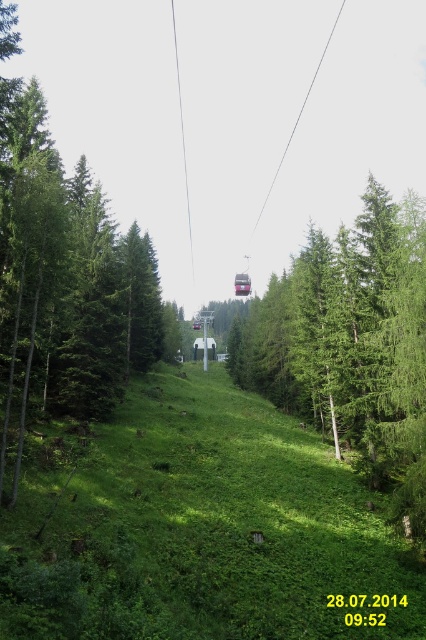
Which of these two, green matte tree at center or green leafy tree at center, stands taller?

With more height is green matte tree at center.

In the scene shown: Is green matte tree at center above green leafy tree at center?

Indeed, green matte tree at center is positioned over green leafy tree at center.

Find the location of `green matte tree at center`. green matte tree at center is located at coordinates (63, 285).

You are a GUI agent. You are given a task and a screenshot of the screen. Output one action in this format:
    pyautogui.click(x=<x>, y=<y>)
    Task: Click on the green matte tree at center
    The height and width of the screenshot is (640, 426).
    Given the screenshot: What is the action you would take?
    pyautogui.click(x=63, y=285)